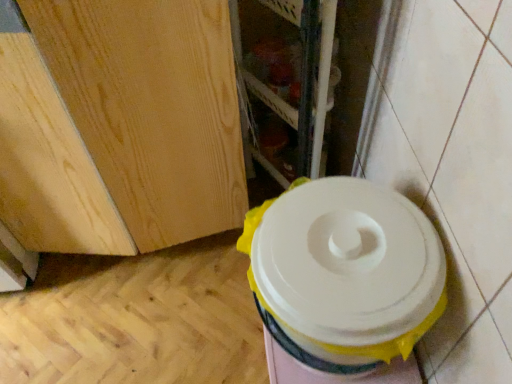
Question: Is white plastic toilet at lower right facing towards wooden shelf at center?

Choices:
 (A) yes
 (B) no

Answer: (B)

Question: Is white plastic toilet at lower right facing away from wooden shelf at center?

Choices:
 (A) no
 (B) yes

Answer: (A)

Question: Can you confirm if white plastic toilet at lower right is taller than wooden shelf at center?

Choices:
 (A) no
 (B) yes

Answer: (A)

Question: Is white plastic toilet at lower right completely or partially outside of wooden shelf at center?

Choices:
 (A) no
 (B) yes

Answer: (B)

Question: From the image's perspective, would you say white plastic toilet at lower right is shown under wooden shelf at center?

Choices:
 (A) no
 (B) yes

Answer: (B)

Question: Is white plastic toilet at lower right wider than wooden shelf at center?

Choices:
 (A) yes
 (B) no

Answer: (A)

Question: Is wooden shelf at center placed right next to white plastic toilet at lower right?

Choices:
 (A) no
 (B) yes

Answer: (A)

Question: Is wooden shelf at center wider than white plastic toilet at lower right?

Choices:
 (A) no
 (B) yes

Answer: (A)

Question: Is wooden shelf at center shorter than white plastic toilet at lower right?

Choices:
 (A) no
 (B) yes

Answer: (A)

Question: Is wooden shelf at center turned away from white plastic toilet at lower right?

Choices:
 (A) no
 (B) yes

Answer: (A)

Question: From the image's perspective, would you say wooden shelf at center is positioned over white plastic toilet at lower right?

Choices:
 (A) yes
 (B) no

Answer: (A)

Question: Does wooden shelf at center appear on the left side of white plastic toilet at lower right?

Choices:
 (A) yes
 (B) no

Answer: (A)

Question: Is wooden shelf at center spatially inside white plastic toilet at lower right, or outside of it?

Choices:
 (A) outside
 (B) inside

Answer: (A)